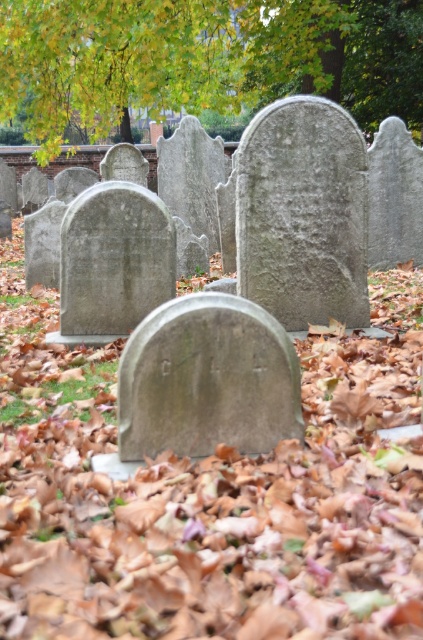
From the picture: You are standing at point (49, 22) and want to walk to point (192, 337) in the cemetery. Which direction should you face to move towards your destination?

You should face towards the front because point (49, 22) is behind point (192, 337), so moving forward will take you towards the destination.

You are standing in a cemetery and see the green leafy tree at upper center and the gray stone gravestone at center. Which object is shorter?

The green leafy tree at upper center is shorter than the gray stone gravestone at center.

You are standing in a cemetery during autumn and notice a green leafy tree at upper center. Can you determine if the tree is positioned above or below the central gravestone named GILL?

The green leafy tree at upper center is located at point coordinates higher than the central gravestone named GILL, so the tree is positioned above the gravestone.